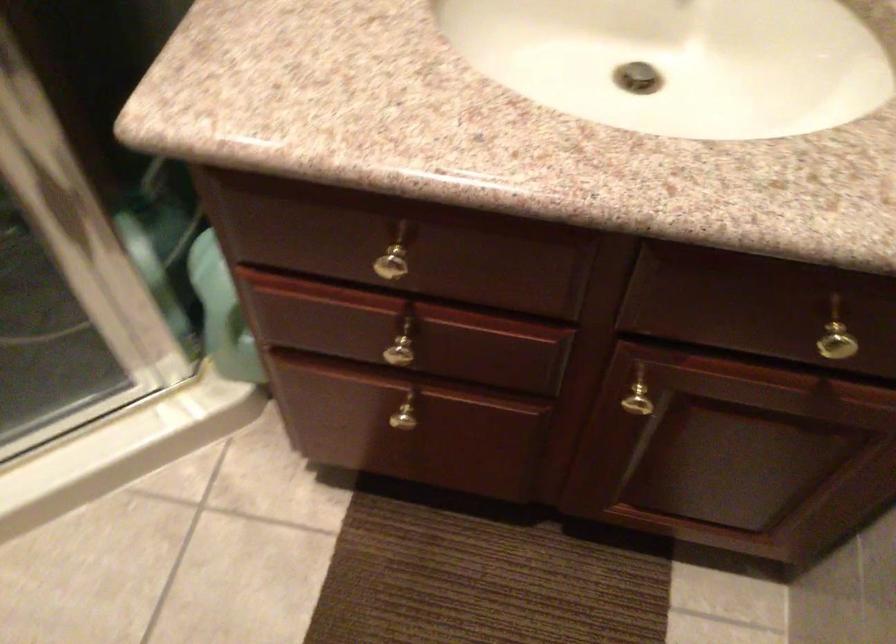
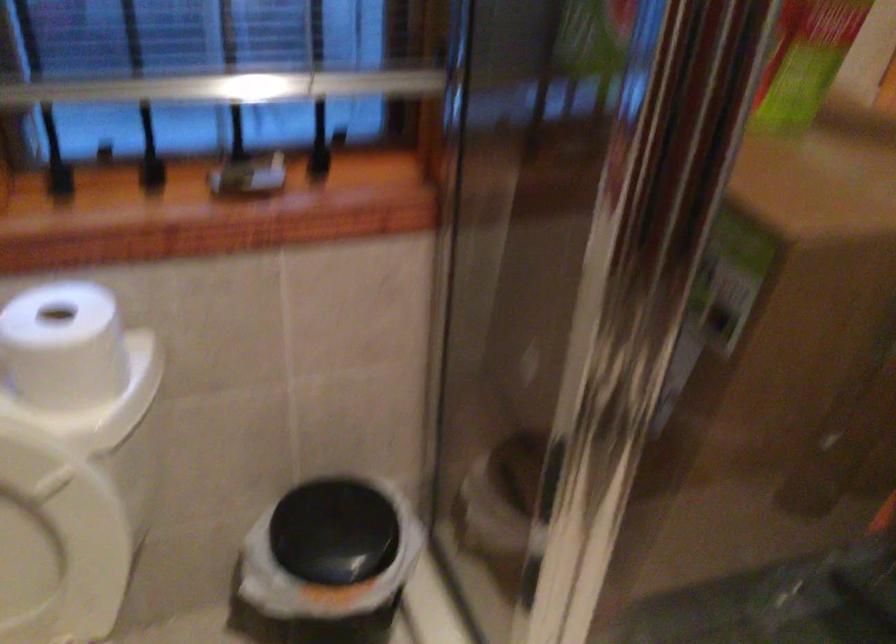
Question: The camera is either moving clockwise (left) or counter-clockwise (right) around the object. The first image is from the beginning of the video and the second image is from the end. Is the camera moving left or right when shooting the video?

Choices:
 (A) Left
 (B) Right

Answer: (B)